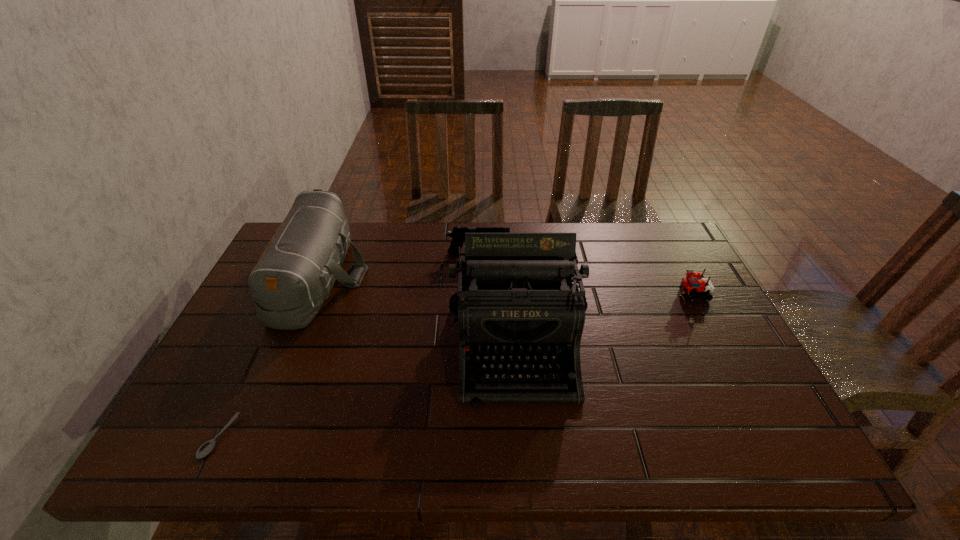
Locate an element on the screen. The width and height of the screenshot is (960, 540). vacant space that's between the soupspoon and the second tallest object is located at coordinates (269, 357).

Locate an element on the screen. Image resolution: width=960 pixels, height=540 pixels. free space between the second tallest object and the nearest object is located at coordinates (269, 357).

This screenshot has height=540, width=960. Identify the location of vacant space in between the nearest object and the gun. (348, 345).

Identify the location of vacant point located between the shortest object and the duffel bag. (269, 357).

Where is `the fourth closest object to the gun`? Image resolution: width=960 pixels, height=540 pixels. the fourth closest object to the gun is located at coordinates (207, 447).

The height and width of the screenshot is (540, 960). Find the location of `the closest object to the duffel bag`. the closest object to the duffel bag is located at coordinates (207, 447).